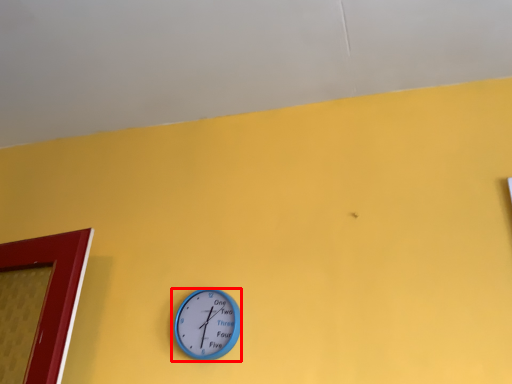
Question: In this image, where is wall clock (annotated by the red box) located relative to backdrop?

Choices:
 (A) left
 (B) right

Answer: (B)